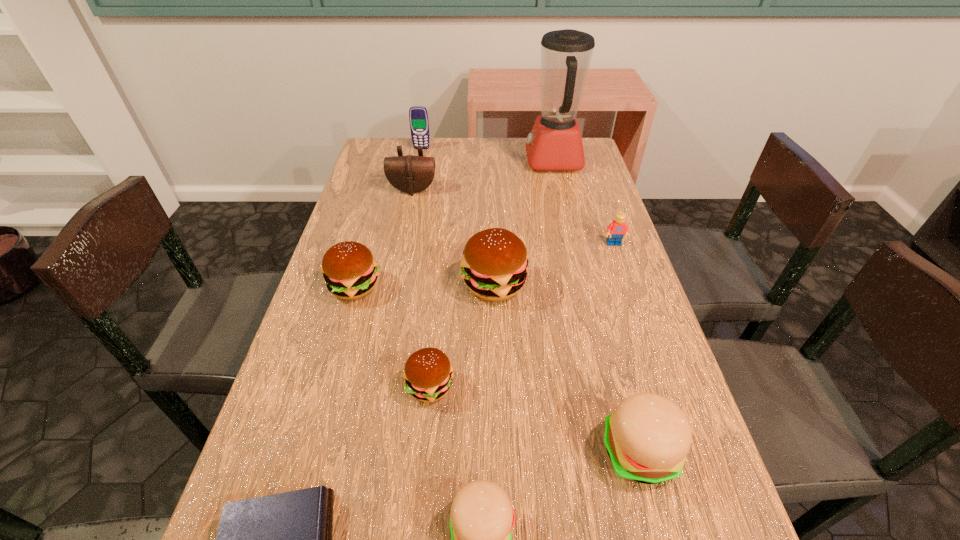
The width and height of the screenshot is (960, 540). I want to click on Lego that is at the right edge, so click(x=617, y=228).

Find the location of `object that is at the far left corner`. object that is at the far left corner is located at coordinates (418, 116).

Locate an element on the screen. This screenshot has width=960, height=540. object that is at the far right corner is located at coordinates (555, 144).

This screenshot has width=960, height=540. What are the coordinates of `vacant space at the far edge` in the screenshot? It's located at (451, 165).

Identify the location of vacant space at the left edge of the desktop. Image resolution: width=960 pixels, height=540 pixels. (380, 229).

The width and height of the screenshot is (960, 540). What are the coordinates of `vacant space at the right edge of the desktop` in the screenshot? It's located at (727, 534).

In the image, there is a desktop. At what (x,y) coordinates should I click in order to perform the action: click on free space at the far left corner. Please return your answer as a coordinate pair (x, y). This screenshot has height=540, width=960. Looking at the image, I should click on (392, 153).

The height and width of the screenshot is (540, 960). I want to click on free space between the tallest object and the fourth farthest hamburger, so click(x=596, y=306).

What are the coordinates of `free area in between the biggest brown hamburger and the tallest object` in the screenshot? It's located at (524, 222).

I want to click on free spot between the Lego and the blender, so point(584,202).